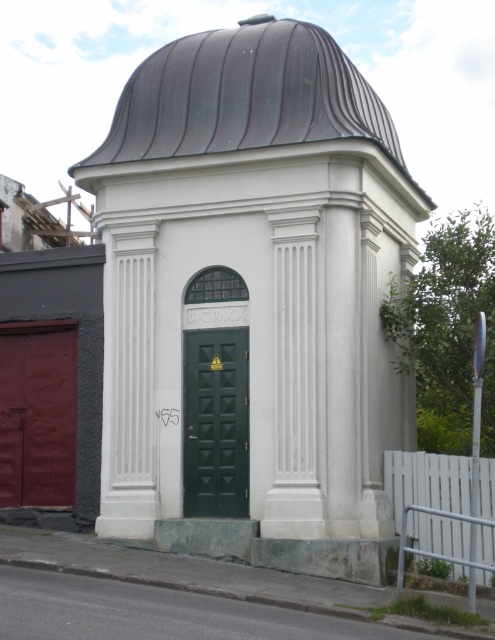
Between white smooth chapel at center and green matte door at center, which one appears on the right side from the viewer's perspective?

white smooth chapel at center is more to the right.

Does white smooth chapel at center appear on the left side of green matte door at center?

Incorrect, white smooth chapel at center is not on the left side of green matte door at center.

Measure the distance between white smooth chapel at center and camera.

12.00 meters

I want to click on white smooth chapel at center, so click(252, 301).

Find the location of a particular element. This screenshot has height=640, width=495. white smooth chapel at center is located at coordinates (252, 301).

Between white smooth chapel at center and metallic dome at center, which one appears on the left side from the viewer's perspective?

metallic dome at center

Is point (170, 140) closer to camera compared to point (304, 28)?

That is True.

Identify the location of white smooth chapel at center. The width and height of the screenshot is (495, 640). (252, 301).

Is point (309, 132) positioned before point (205, 508)?

No, (309, 132) is further to viewer.

Can you confirm if metallic dome at center is smaller than green matte door at center?

No, metallic dome at center is not smaller than green matte door at center.

I want to click on metallic dome at center, so click(x=246, y=97).